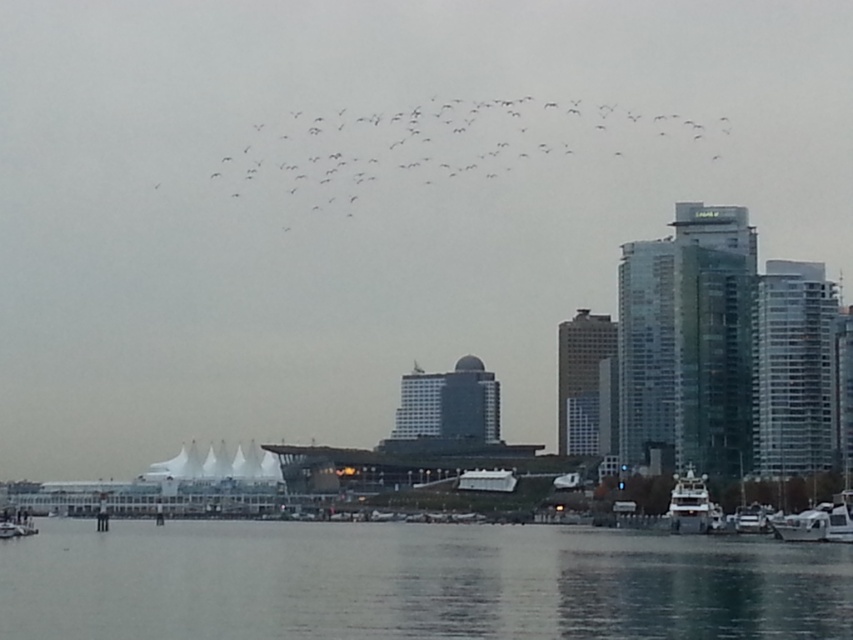
You are a photographer planning to capture the cityscape reflected in the transparent water at lower center and the white glossy yacht at lower right. Since you want to include both objects in your shot, will the yacht fit within the water area in the frame?

The transparent water at lower center has a larger width than the white glossy yacht at lower right, so the yacht will fit within the water area in the frame.

You are standing on the dock and looking at the point marked by coordinates (413, 582). What is located there?

The point at coordinates (413, 582) indicates transparent water at lower center.